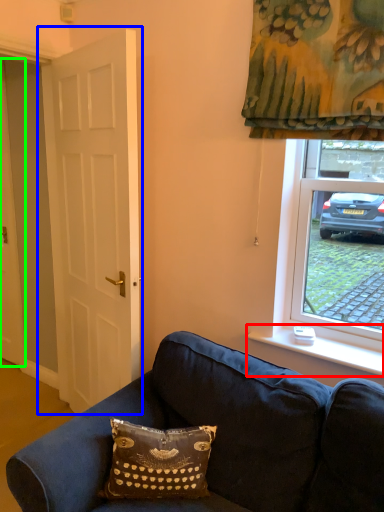
Question: Based on their relative distances, which object is nearer to window sill (highlighted by a red box)? Choose from door (highlighted by a blue box) and door (highlighted by a green box).

Choices:
 (A) door
 (B) door

Answer: (A)